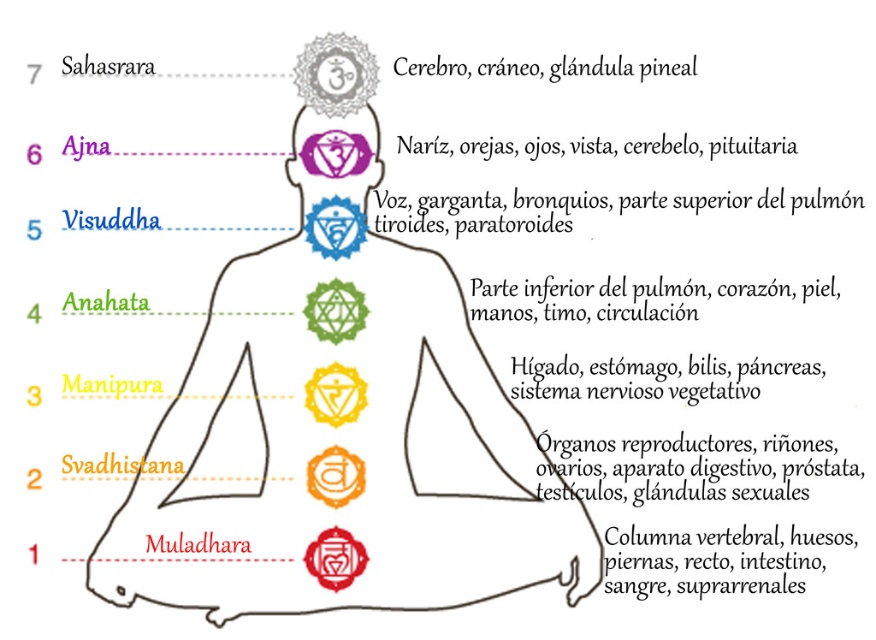
Question: Can you confirm if green glossy chakra at center is bigger than red glossy circle at lower center?

Choices:
 (A) no
 (B) yes

Answer: (A)

Question: Is matte purple chakra at upper center wider than yellow matte chakra at center?

Choices:
 (A) yes
 (B) no

Answer: (A)

Question: Which is farther from the green glossy chakra at center?

Choices:
 (A) yellow matte chakra at center
 (B) orange glossy chakra at center
 (C) matte purple chakra at upper center
 (D) red glossy circle at lower center

Answer: (D)

Question: Considering the relative positions of matte purple chakra at upper center and orange glossy chakra at center in the image provided, where is matte purple chakra at upper center located with respect to orange glossy chakra at center?

Choices:
 (A) below
 (B) above

Answer: (B)

Question: Which object is positioned farthest from the matte purple chakra at upper center?

Choices:
 (A) green glossy chakra at center
 (B) yellow matte chakra at center

Answer: (A)

Question: Which point appears closest to the camera in this image?

Choices:
 (A) (345, 545)
 (B) (357, 490)

Answer: (B)